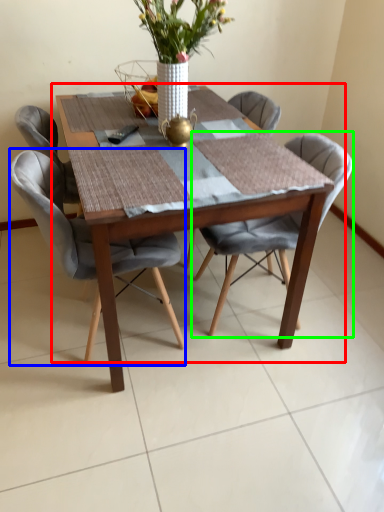
Question: Which object is the farthest from kitchen & dining room table (highlighted by a red box)? Choose among these: chair (highlighted by a blue box) or chair (highlighted by a green box).

Choices:
 (A) chair
 (B) chair

Answer: (B)